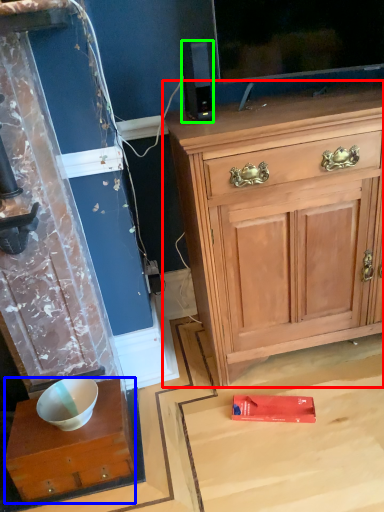
Question: Which is farther away from cabinetry (highlighted by a red box)? desk (highlighted by a blue box) or loudspeaker (highlighted by a green box)?

Choices:
 (A) desk
 (B) loudspeaker

Answer: (A)